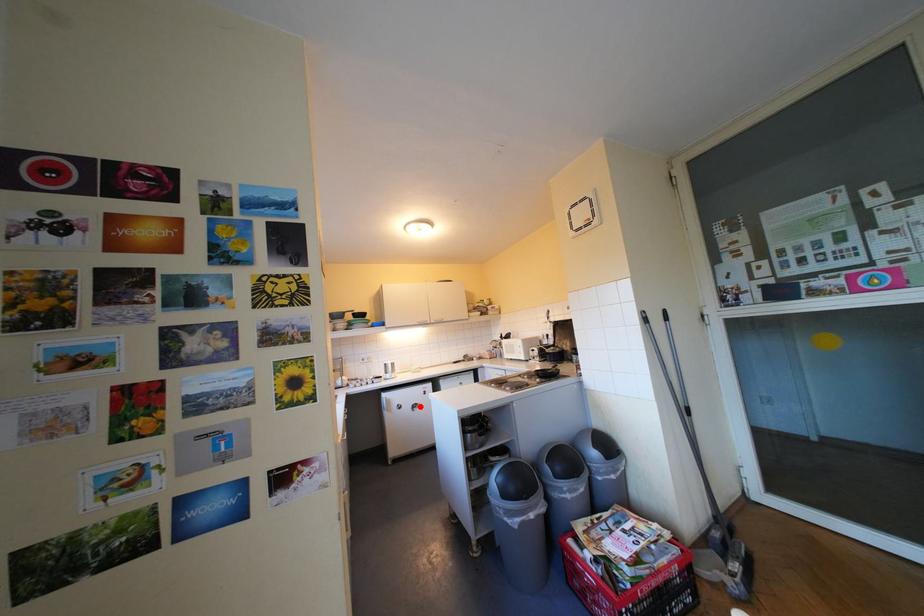
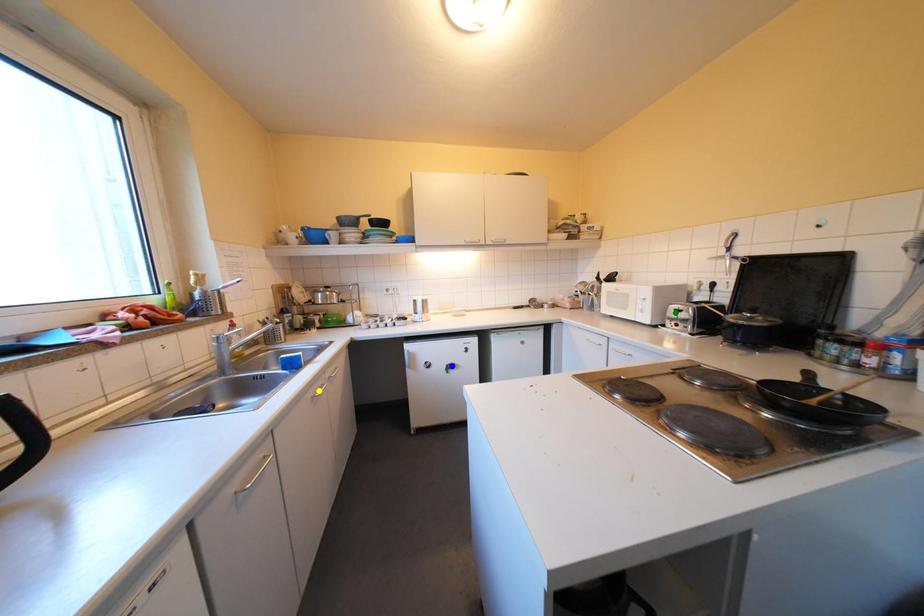
Question: I am providing you with two images of the same scene from different viewpoints. A red point is marked on the first image. You are given multiple points on the second image. Which mark in image 2 goes with the point in image 1?

Choices:
 (A) yellow point
 (B) blue point
 (C) green point

Answer: (B)